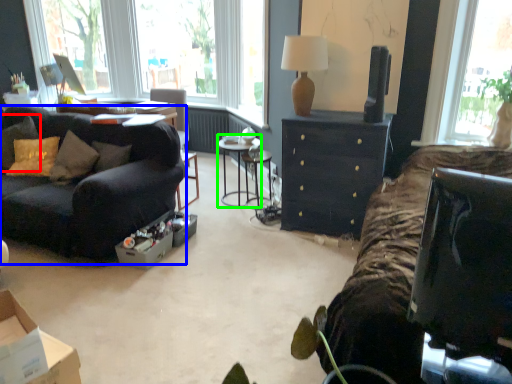
Question: Considering the real-world distances, which object is farthest from pillow (highlighted by a red box)? studio couch (highlighted by a blue box) or side table (highlighted by a green box)?

Choices:
 (A) studio couch
 (B) side table

Answer: (B)